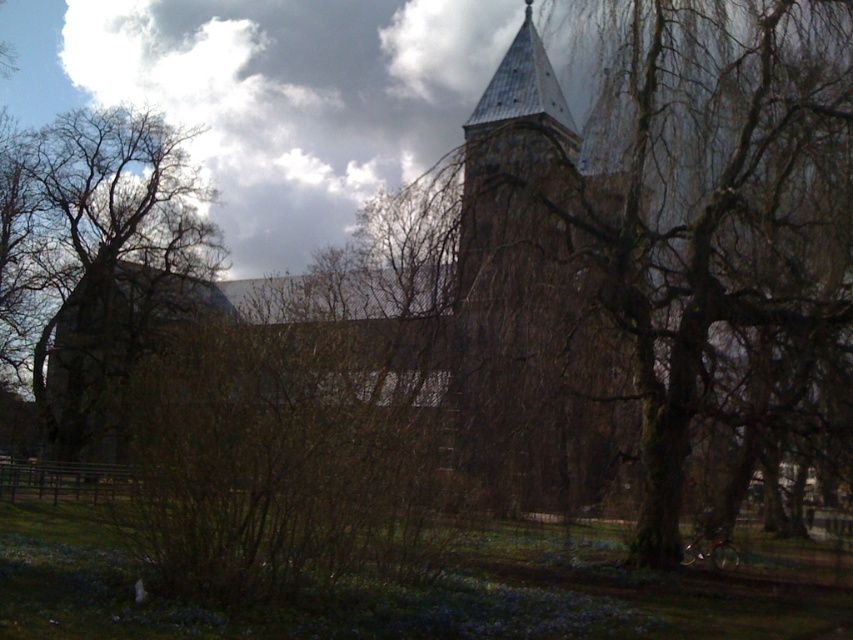
You are standing in front of the historic stone church and notice two trees in the scene. Which tree, the brown bark tree at center or the brown rough bark tree at left, is positioned higher up in the image?

The brown bark tree at center is positioned higher up in the image than the brown rough bark tree at left.

You are a gardener planning to trim the brown textured bush at center and the brown rough bark tree at left. Based on their positions, which object is closer to the ground?

The brown textured bush at center is positioned under the brown rough bark tree at left, so the brown textured bush at center is closer to the ground.

You are planning to install a new pathway between the brown textured bush at center and the brown rough bark tree at left. The pathway requires a minimum of 60 feet of space. Based on the scene, is there enough space for the pathway?

The distance between the brown textured bush at center and the brown rough bark tree at left is 61.49 feet, which exceeds the required 60 feet. Therefore, there is sufficient space to install the pathway.